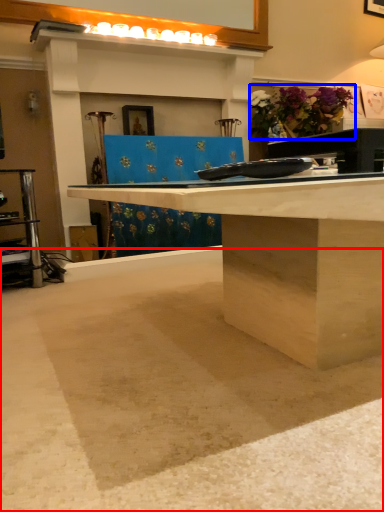
Question: Which object appears closest to the camera in this image, concrete (highlighted by a red box) or flower (highlighted by a blue box)?

Choices:
 (A) concrete
 (B) flower

Answer: (A)